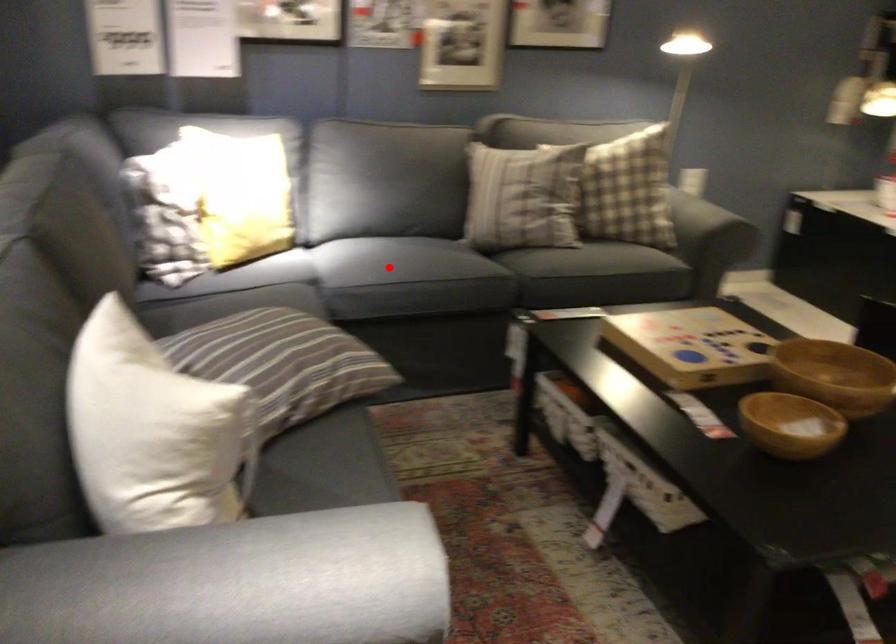
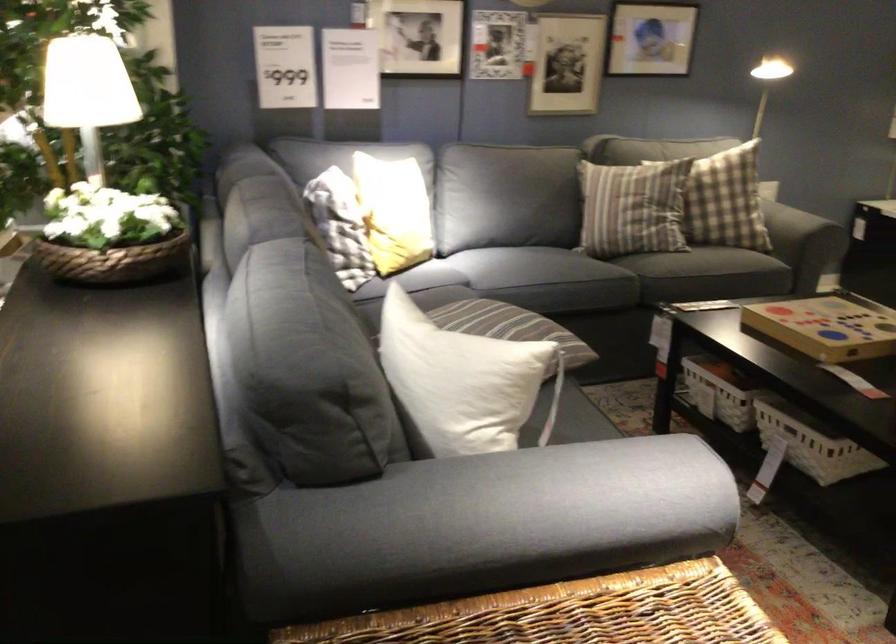
Find the pixel in the second image that matches the highlighted location in the first image.

(538, 267)